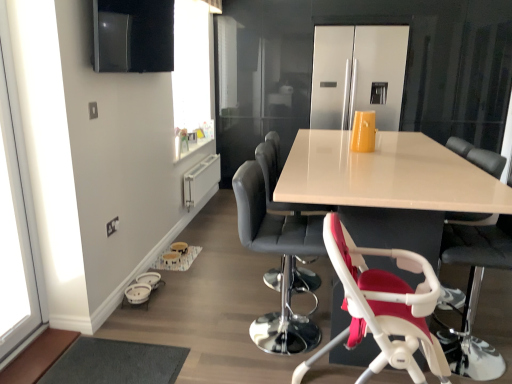
Identify the location of free spot to the left of leather-like black chair at center, which is the 1th chair from back to front. (233, 278).